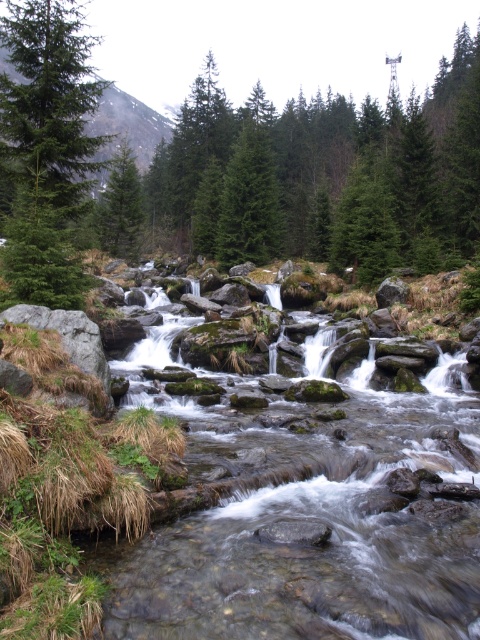
Looking at this image, can you confirm if green matte tree at left is shorter than green matte tree at center?

In fact, green matte tree at left may be taller than green matte tree at center.

Between green matte tree at left and green matte tree at center, which one appears on the left side from the viewer's perspective?

From the viewer's perspective, green matte tree at left appears more on the left side.

You are a GUI agent. You are given a task and a screenshot of the screen. Output one action in this format:
    pyautogui.click(x=<x>, y=<y>)
    Task: Click on the green matte tree at left
    The image size is (480, 640).
    Given the screenshot: What is the action you would take?
    pyautogui.click(x=47, y=147)

This screenshot has width=480, height=640. In order to click on green matte tree at left in this screenshot , I will do `click(47, 147)`.

In the scene shown: Is green matte tree at left taller than green matte evergreen tree at center?

Indeed, green matte tree at left has a greater height compared to green matte evergreen tree at center.

Is green matte tree at left smaller than green matte evergreen tree at center?

Incorrect, green matte tree at left is not smaller in size than green matte evergreen tree at center.

Who is more forward, (21, 22) or (100, 241)?

Point (21, 22) is more forward.

Identify the location of green matte tree at left. (47, 147).

Can you confirm if green matte tree at center is positioned below green matte evergreen tree at center?

Yes.

Does green matte tree at center appear over green matte evergreen tree at center?

No.

Where is `green matte tree at center`? Image resolution: width=480 pixels, height=640 pixels. green matte tree at center is located at coordinates (250, 198).

Image resolution: width=480 pixels, height=640 pixels. Identify the location of green matte tree at center. (250, 198).